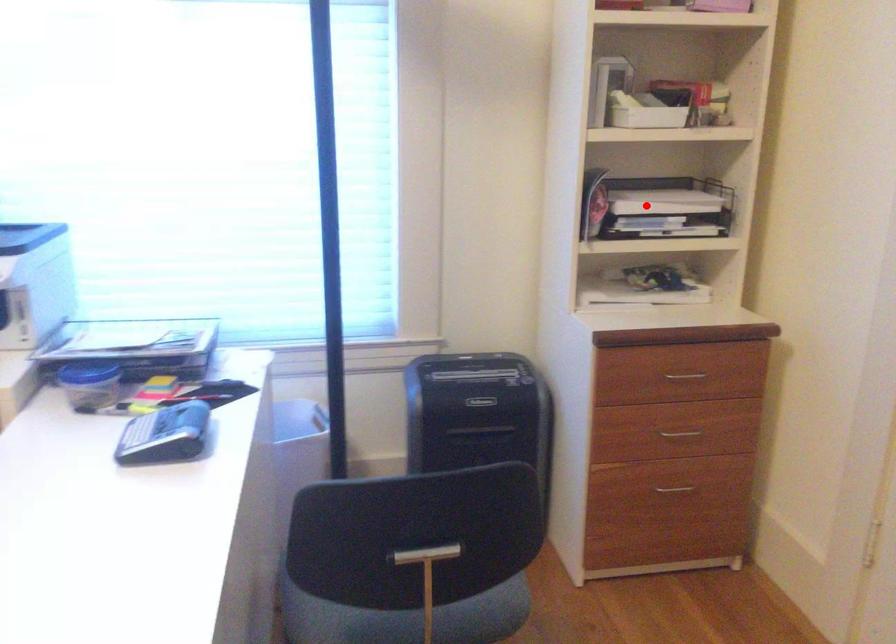
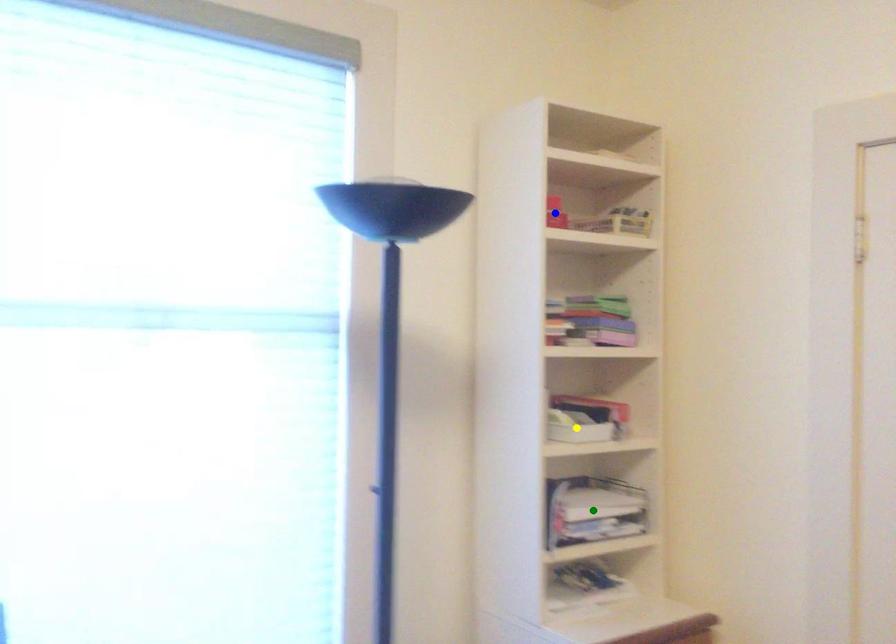
Question: I am providing you with two images of the same scene from different viewpoints. A red point is marked on the first image. You are given multiple points on the second image. Can you choose the point in image 2 that corresponds to the point in image 1?

Choices:
 (A) yellow point
 (B) blue point
 (C) green point

Answer: (C)